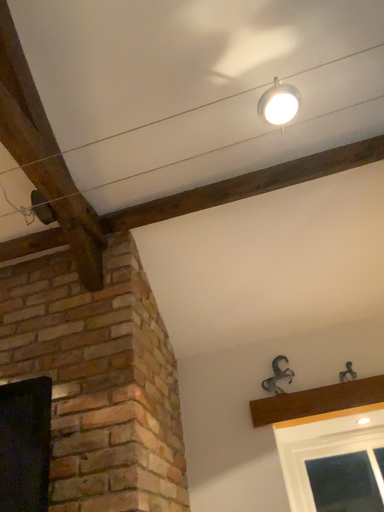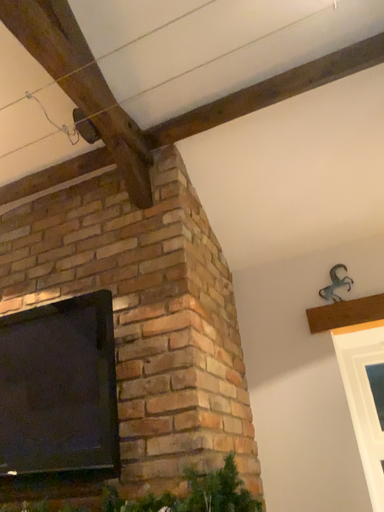
Question: Which way did the camera rotate in the video?

Choices:
 (A) rotated left
 (B) rotated right

Answer: (A)